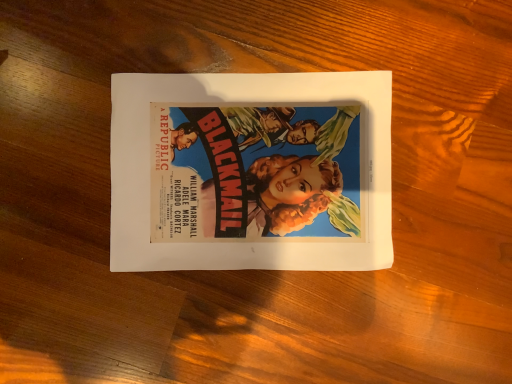
The image size is (512, 384). Describe the element at coordinates (251, 171) in the screenshot. I see `matte paper poster at center` at that location.

At what (x,y) coordinates should I click in order to perform the action: click on matte paper poster at center. Please return your answer as a coordinate pair (x, y). The height and width of the screenshot is (384, 512). Looking at the image, I should click on (251, 171).

Locate an element on the screen. matte paper poster at center is located at coordinates (251, 171).